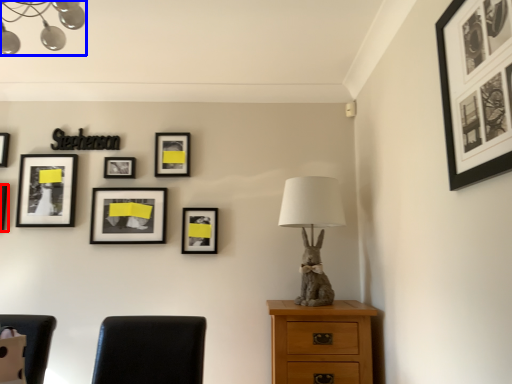
Question: Which object appears farthest to the camera in this image, picture frame (highlighted by a red box) or lamp (highlighted by a blue box)?

Choices:
 (A) picture frame
 (B) lamp

Answer: (A)